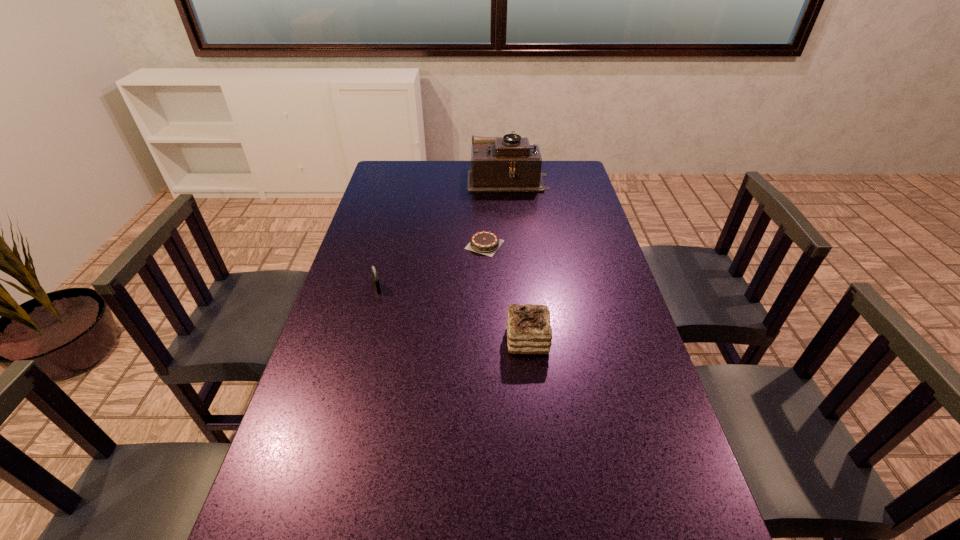
The height and width of the screenshot is (540, 960). I want to click on empty location between the tallest object and the nearest object, so click(517, 259).

You are a GUI agent. You are given a task and a screenshot of the screen. Output one action in this format:
    pyautogui.click(x=<x>, y=<y>)
    Task: Click on the second closest object to the tallest object
    
    Given the screenshot: What is the action you would take?
    pyautogui.click(x=375, y=278)

Locate an element on the screen. This screenshot has width=960, height=540. object that is the third closest to the farthest object is located at coordinates (529, 331).

The image size is (960, 540). Find the location of `vacant area in the image that satisfies the following two spatial constraints: 1. on the horn of the tallest object; 2. on the left side of the nearer chocolate cake`. vacant area in the image that satisfies the following two spatial constraints: 1. on the horn of the tallest object; 2. on the left side of the nearer chocolate cake is located at coordinates 523,340.

Locate an element on the screen. Image resolution: width=960 pixels, height=540 pixels. free point that satisfies the following two spatial constraints: 1. on the horn of the phonograph_record; 2. on the back side of the taller chocolate cake is located at coordinates (523, 340).

Where is `vacant space that satisfies the following two spatial constraints: 1. on the horn of the phonograph_record; 2. on the front side of the farther chocolate cake`? This screenshot has height=540, width=960. vacant space that satisfies the following two spatial constraints: 1. on the horn of the phonograph_record; 2. on the front side of the farther chocolate cake is located at coordinates (515, 245).

This screenshot has width=960, height=540. In order to click on blank space that satisfies the following two spatial constraints: 1. on the horn of the farthest object; 2. on the front side of the padlock in this screenshot , I will do `click(518, 288)`.

Locate an element on the screen. free space that satisfies the following two spatial constraints: 1. on the back side of the padlock; 2. on the left side of the third nearest object is located at coordinates (389, 245).

At what (x,y) coordinates should I click in order to perform the action: click on vacant area that satisfies the following two spatial constraints: 1. on the front side of the taller chocolate cake; 2. on the right side of the farther chocolate cake. Please return your answer as a coordinate pair (x, y). This screenshot has height=540, width=960. Looking at the image, I should click on (486, 340).

Locate an element on the screen. vacant space that satisfies the following two spatial constraints: 1. on the back side of the shortest object; 2. on the right side of the leftmost object is located at coordinates (389, 245).